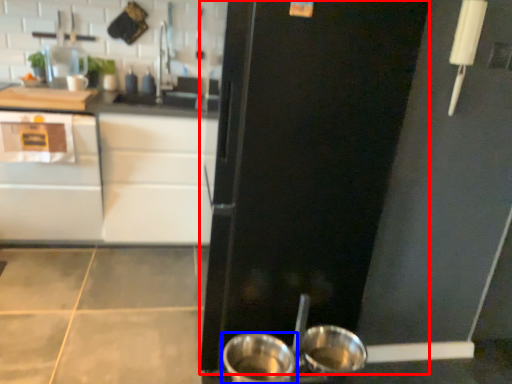
Question: Which point is further to the camera, door (highlighted by a red box) or kitchen appliance (highlighted by a blue box)?

Choices:
 (A) door
 (B) kitchen appliance

Answer: (B)